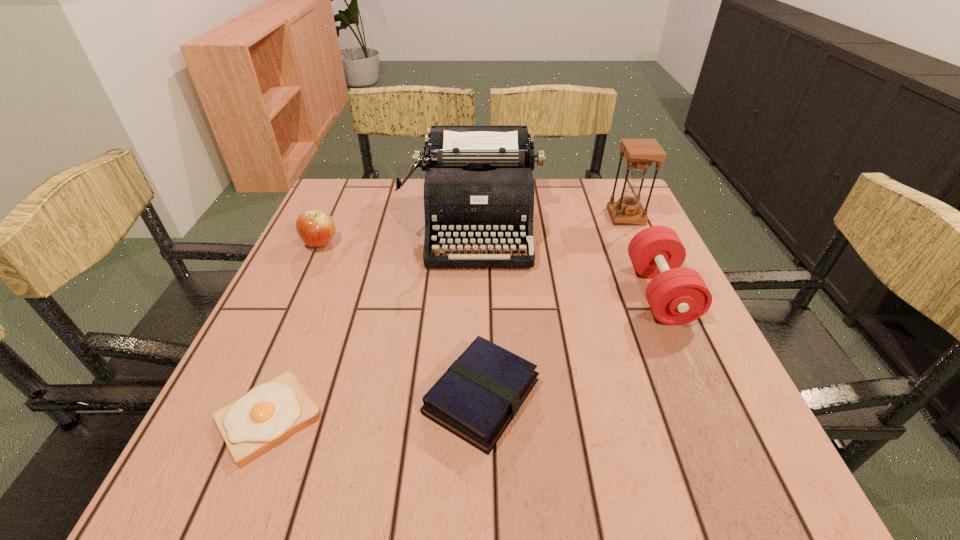
Locate an element on the screen. The height and width of the screenshot is (540, 960). hourglass is located at coordinates (640, 153).

Locate an element on the screen. typewriter is located at coordinates (478, 189).

I want to click on the third tallest object, so click(677, 295).

The image size is (960, 540). Find the location of `the fourth tallest object`. the fourth tallest object is located at coordinates (316, 228).

This screenshot has height=540, width=960. In order to click on the fifth tallest object in this screenshot , I will do `click(477, 397)`.

At what (x,y) coordinates should I click in order to perform the action: click on toast. Please return your answer as a coordinate pair (x, y). Looking at the image, I should click on (269, 413).

Locate an element on the screen. The height and width of the screenshot is (540, 960). vacant point located on the left of the hourglass is located at coordinates (576, 217).

This screenshot has height=540, width=960. I want to click on free space located 0.170m on the typing side of the typewriter, so click(473, 327).

The height and width of the screenshot is (540, 960). Identify the location of vacant space located 0.190m on the front of the fourth shortest object. (713, 414).

Where is `vacant space situated on the right of the third shortest object`? This screenshot has width=960, height=540. vacant space situated on the right of the third shortest object is located at coordinates (435, 244).